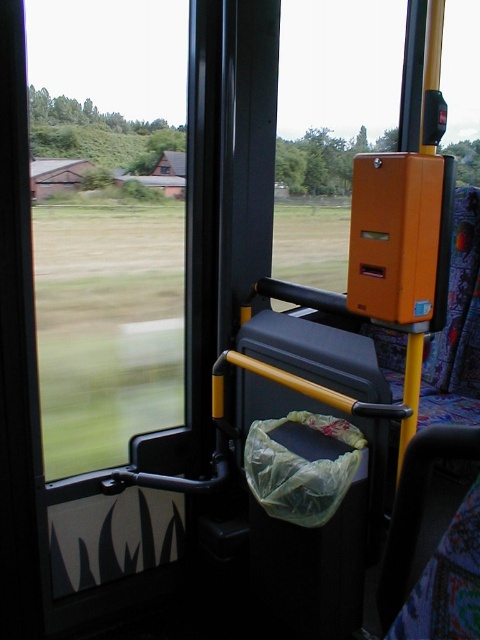
Question: Does transparent glass window at left appear on the left side of orange plastic at upper center?

Choices:
 (A) yes
 (B) no

Answer: (A)

Question: Is transparent glass window at left smaller than orange plastic at upper center?

Choices:
 (A) yes
 (B) no

Answer: (A)

Question: Is transparent glass window at left in front of orange plastic at upper center?

Choices:
 (A) yes
 (B) no

Answer: (A)

Question: Which point is closer to the camera?

Choices:
 (A) (59, 326)
 (B) (302, 220)

Answer: (A)

Question: Which point is closer to the camera?

Choices:
 (A) transparent glass window at left
 (B) orange plastic at upper center

Answer: (A)